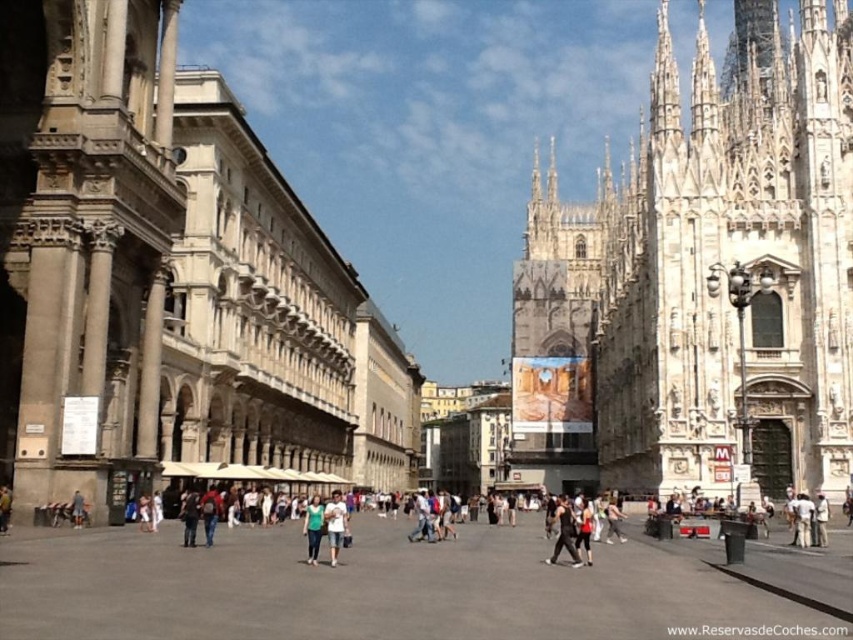
You are standing in the square and want to take a photo of both the white stone church at center and the green fabric shirt at center. To ensure both are in frame, should you position yourself to the left or right side of the square?

Since the white stone church at center is to the left of the green fabric shirt at center, you should position yourself to the right side of the square to capture both in the frame.

You are a fashion designer observing a person wearing light blue denim shorts at center and dark gray fabric jacket at center. Which clothing item might have a larger width measurement?

The light blue denim shorts at center might be wider than the dark gray fabric jacket at center according to the description.